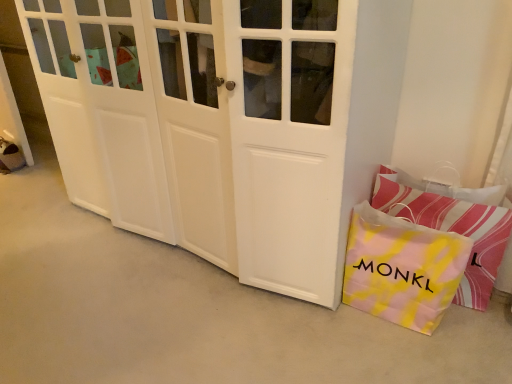
Locate an element on the screen. vacant region to the left of white matte door at center is located at coordinates (55, 242).